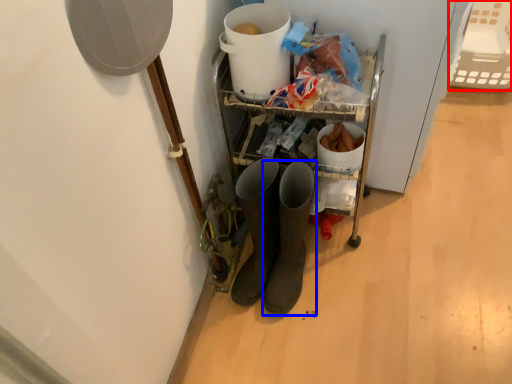
Question: Which object appears farthest to the camera in this image, basket (highlighted by a red box) or footwear (highlighted by a blue box)?

Choices:
 (A) basket
 (B) footwear

Answer: (A)